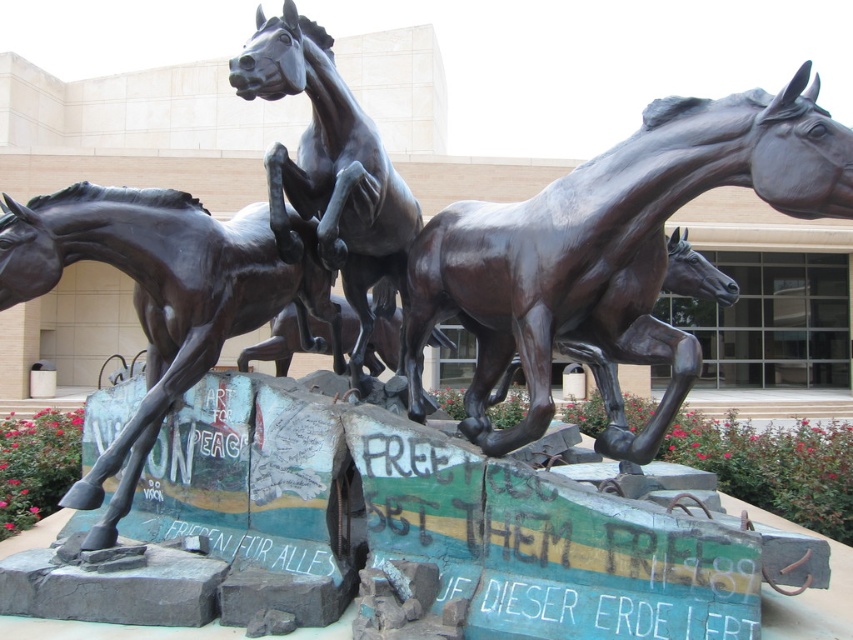
Question: Which object appears closest to the camera in this image?

Choices:
 (A) bronze statue of horse at center
 (B) shiny bronze horse at center

Answer: (B)

Question: Estimate the real-world distances between objects in this image. Which object is farther from the shiny bronze horse at center?

Choices:
 (A) bronze horse at center
 (B) bronze statue of horse at center

Answer: (B)

Question: Can you confirm if shiny bronze horse at center is bigger than bronze horse at center?

Choices:
 (A) no
 (B) yes

Answer: (B)

Question: Which of the following is the farthest from the observer?

Choices:
 (A) bronze statue of horse at center
 (B) bronze horse at center
 (C) shiny bronze horse at center

Answer: (B)

Question: Does bronze statue of horse at center have a smaller size compared to bronze horse at center?

Choices:
 (A) no
 (B) yes

Answer: (A)

Question: Is bronze statue of horse at center above bronze horse at center?

Choices:
 (A) yes
 (B) no

Answer: (B)